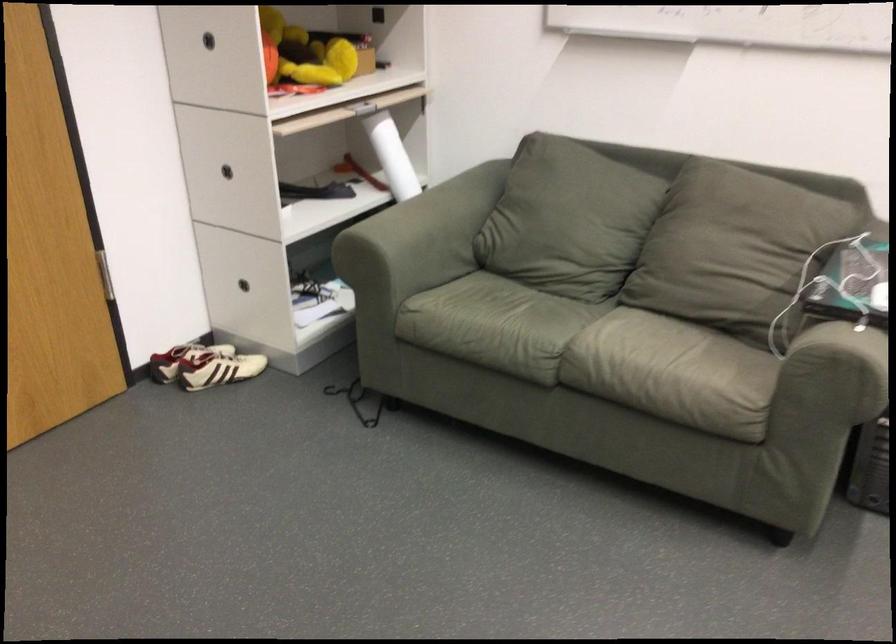
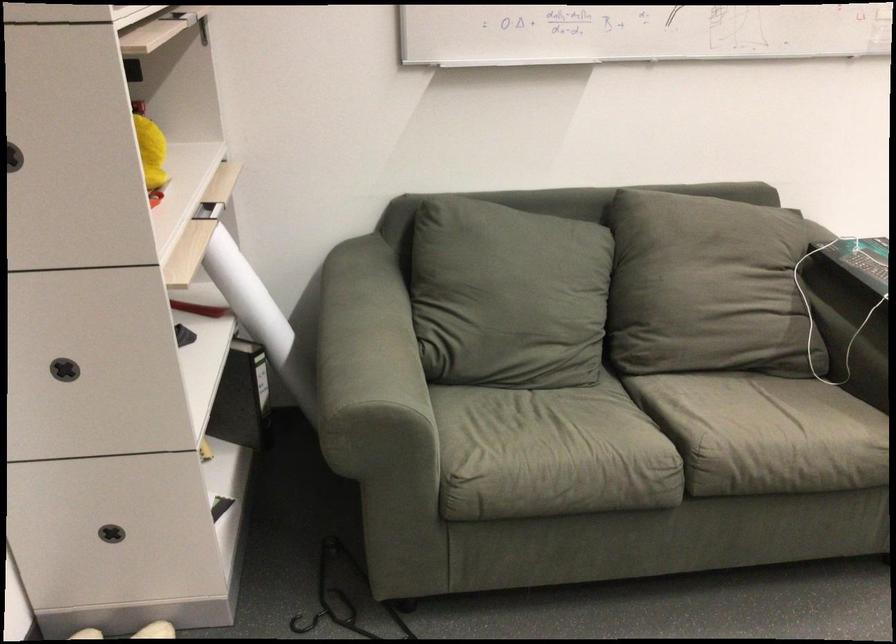
Find the pixel in the second image that matches [367,391] in the first image.

(341, 598)